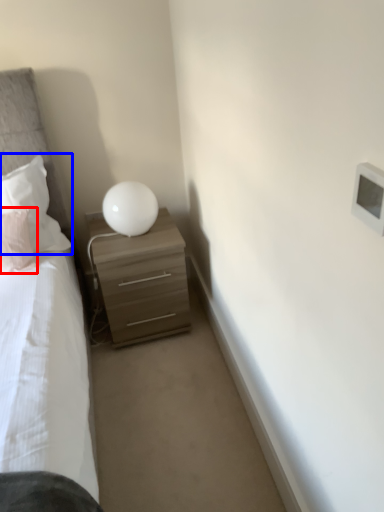
Question: Which object is closer to the camera taking this photo, pillow (highlighted by a red box) or pillow (highlighted by a blue box)?

Choices:
 (A) pillow
 (B) pillow

Answer: (A)